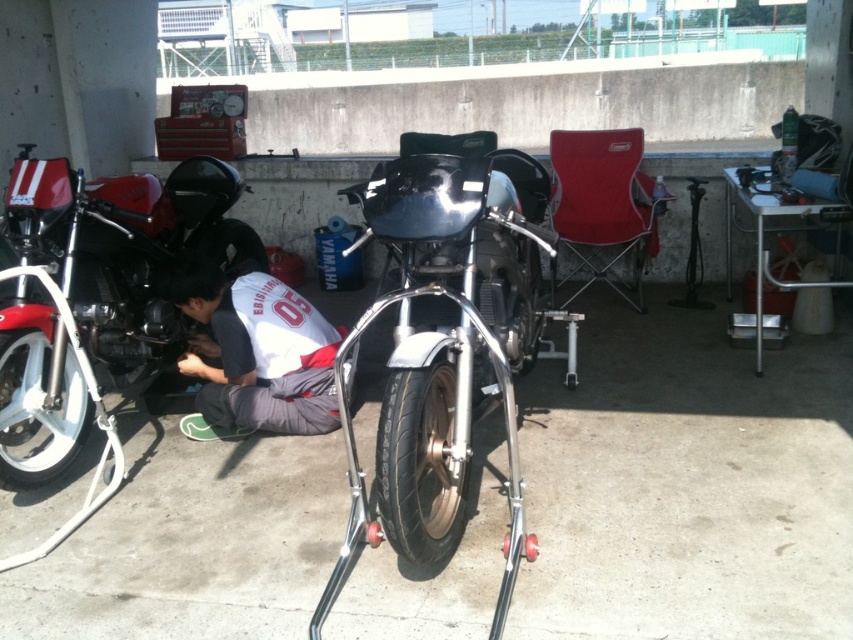
Question: Among these objects, which one is nearest to the camera?

Choices:
 (A) black rubber tire at center
 (B) shiny red motorcycle at left
 (C) white fabric shirt at lower center
 (D) white rubber tire at lower left

Answer: (A)

Question: Does shiny chrome motorcycle at center lie behind shiny red motorcycle at left?

Choices:
 (A) no
 (B) yes

Answer: (A)

Question: Which object is the farthest from the black rubber tire at center?

Choices:
 (A) shiny red motorcycle at left
 (B) white fabric shirt at lower center
 (C) white rubber tire at lower left
 (D) shiny chrome motorcycle at center

Answer: (A)

Question: Is shiny chrome motorcycle at center to the left of shiny red motorcycle at left from the viewer's perspective?

Choices:
 (A) yes
 (B) no

Answer: (B)

Question: Is shiny red motorcycle at left closer to the viewer compared to black rubber tire at center?

Choices:
 (A) yes
 (B) no

Answer: (B)

Question: Which point is closer to the camera?

Choices:
 (A) white fabric shirt at lower center
 (B) shiny chrome motorcycle at center

Answer: (B)